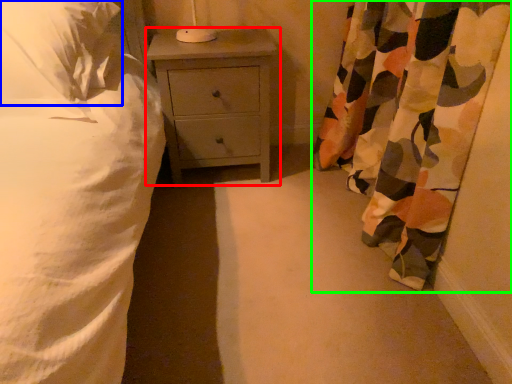
Question: Which object is positioned farthest from nightstand (highlighted by a red box)? Select from pillow (highlighted by a blue box) and curtain (highlighted by a green box).

Choices:
 (A) pillow
 (B) curtain

Answer: (B)